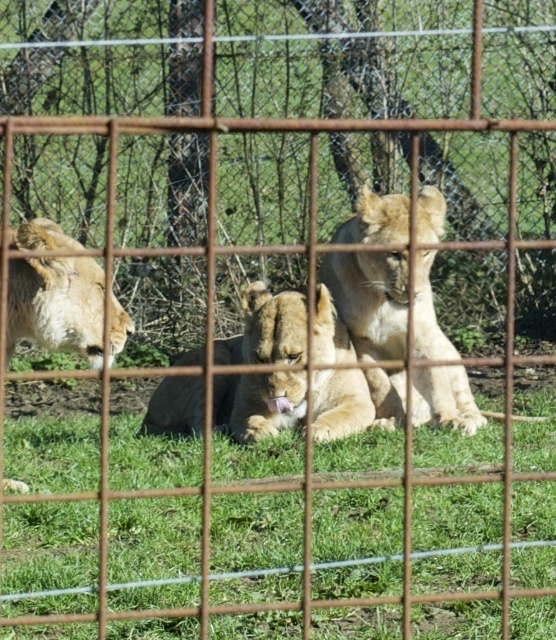
You are a zookeeper standing at the bottom left corner of the enclosure. You need to place a new feeding bowl exactly at the green grass at center. What are the coordinates where you should place it?

The green grass at center is located at point (153, 550), so you should place the feeding bowl there.

You are a zookeeper who needs to feed the golden fur lion at left. You have a food tray that is 3.5 feet wide. If you place the tray on the green grass at center, will the lion be able to reach the entire tray?

The distance between the green grass at center and golden fur lion at left is 4.07 feet. Since the tray is 3.5 feet wide, the lion can reach the entire tray as the distance is greater than the tray width.